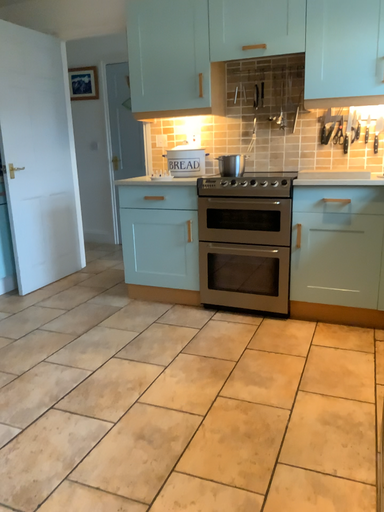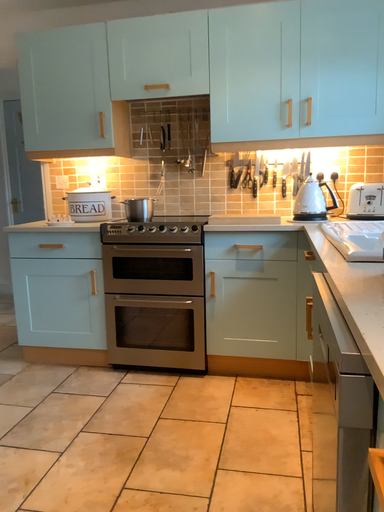
Question: How did the camera likely rotate when shooting the video?

Choices:
 (A) rotated left
 (B) rotated right

Answer: (B)